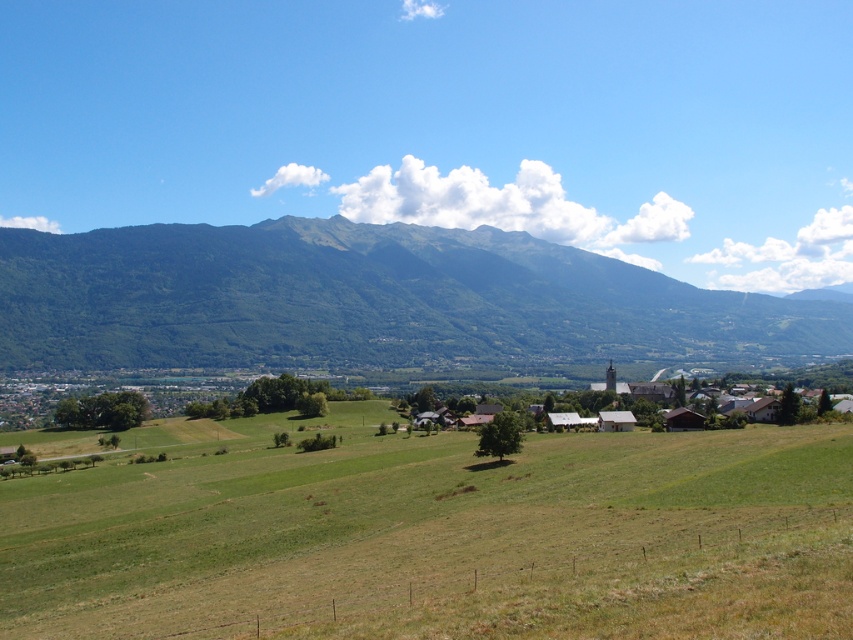
Question: Which point is farther to the camera?

Choices:
 (A) green grassy field at center
 (B) green forested mountain at center

Answer: (B)

Question: Which point is closer to the camera?

Choices:
 (A) green forested mountain at center
 (B) green grassy field at center

Answer: (B)

Question: Can you confirm if green grassy field at center is bigger than green forested mountain at center?

Choices:
 (A) yes
 (B) no

Answer: (B)

Question: Among these objects, which one is farthest from the camera?

Choices:
 (A) green grassy field at center
 (B) green forested mountain at center

Answer: (B)

Question: Does green grassy field at center appear on the right side of green forested mountain at center?

Choices:
 (A) no
 (B) yes

Answer: (A)

Question: From the image, what is the correct spatial relationship of green grassy field at center in relation to green forested mountain at center?

Choices:
 (A) left
 (B) right

Answer: (A)